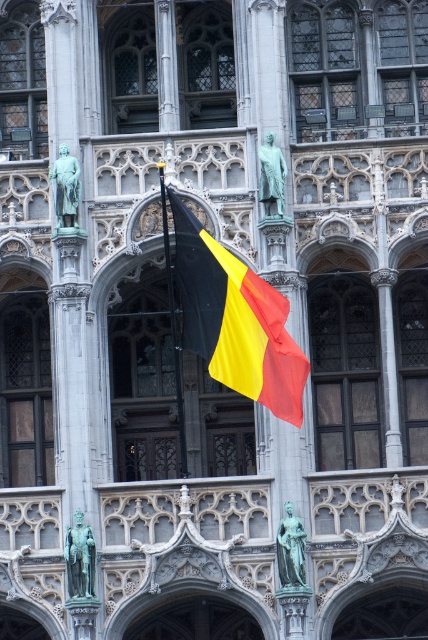
You are an architect inspecting the building facade. You notice the black matte flag at center and the green patinated bronze statue at upper left. Which object is taller?

The green patinated bronze statue at upper left is taller than the black matte flag at center.

You are standing in front of the grand Gothic building and want to take a photo of the green patinated bronze statue at upper left and the black matte flag at center. Which object should you point your camera towards first if you want to capture both in a single shot without moving the camera?

You should point your camera towards the green patinated bronze statue at upper left first because the black matte flag at center is to the right of it, so capturing the statue first will ensure both are in frame without needing to reposition the camera.

You are an architect assessing the symmetry of the building facade. You notice the green patinated bronze statue at upper left and the bronze statue at upper center. Which statue is narrower in width?

The green patinated bronze statue at upper left is narrower in width compared to the bronze statue at upper center.